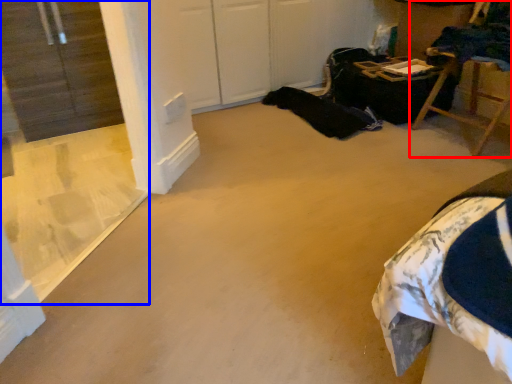
Question: Among these objects, which one is farthest to the camera, furniture (highlighted by a red box) or window (highlighted by a blue box)?

Choices:
 (A) furniture
 (B) window

Answer: (A)